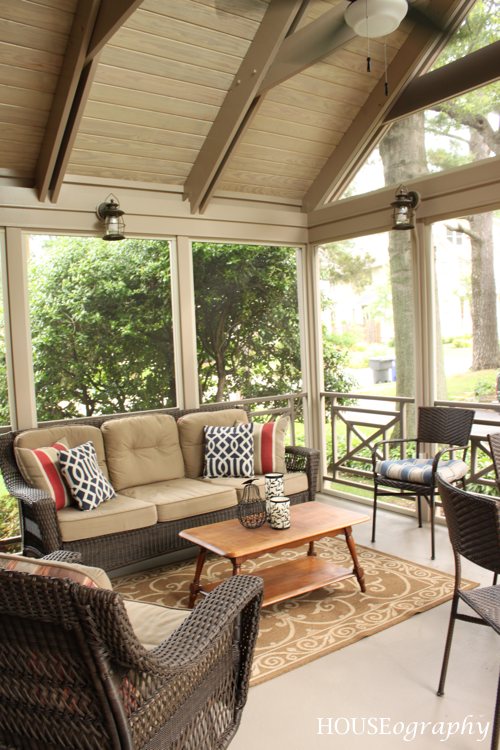
The width and height of the screenshot is (500, 750). I want to click on fan pull, so click(367, 32), click(384, 61).